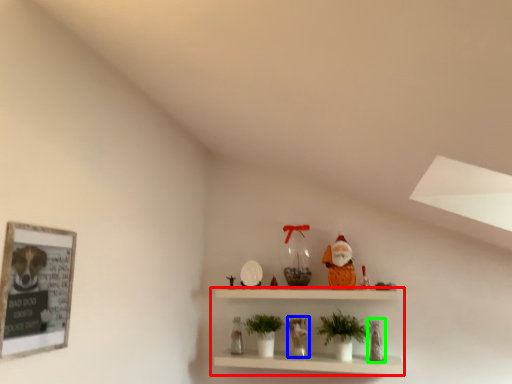
Question: Which is farther away from shelf (highlighted by a red box)? toy (highlighted by a blue box) or toy (highlighted by a green box)?

Choices:
 (A) toy
 (B) toy

Answer: (B)